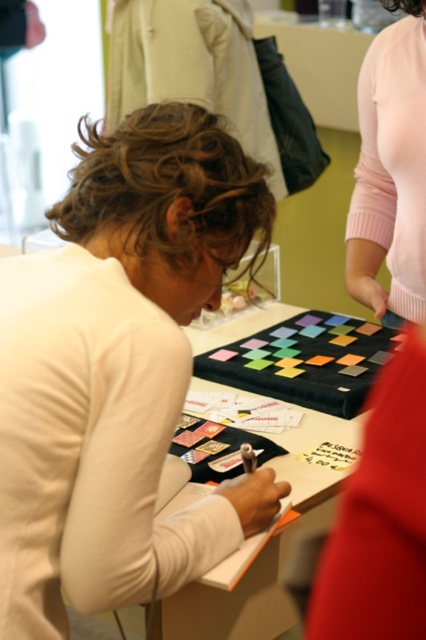
Question: Is matte white shirt at center below black fabric at center?

Choices:
 (A) no
 (B) yes

Answer: (A)

Question: In this image, where is matte white shirt at center located relative to black fabric at center?

Choices:
 (A) above
 (B) below

Answer: (A)

Question: Which object is positioned closest to the pink sweater at upper right?

Choices:
 (A) matte white shirt at center
 (B) black fabric at center

Answer: (B)

Question: Can you confirm if pink sweater at upper right is wider than black fabric at center?

Choices:
 (A) yes
 (B) no

Answer: (B)

Question: Among these points, which one is nearest to the camera?

Choices:
 (A) (400, 163)
 (B) (247, 220)

Answer: (B)

Question: Which object appears closest to the camera in this image?

Choices:
 (A) black fabric at center
 (B) matte white shirt at center

Answer: (B)